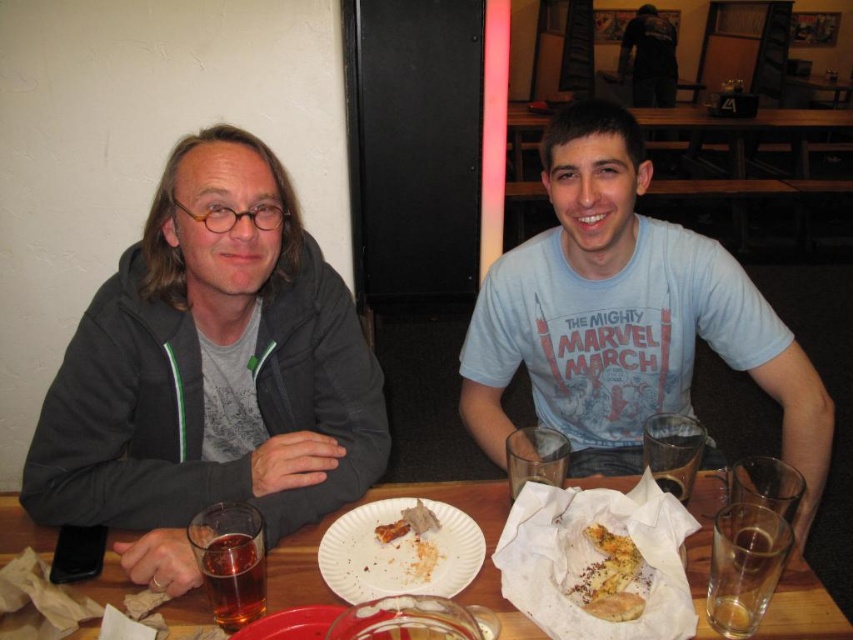
You are a photographer standing in front of the wooden table at center and the brown crumbly bread at center. You want to take a photo that focuses on the bread while keeping the table in the background. Which object should be placed closer to the camera?

The brown crumbly bread at center should be placed closer to the camera than the wooden table at center to focus on the bread while keeping the table in the background.

You are a waiter at the table. You need to place a new menu on the table. The menu is 12 inches wide. The translucent glass at table right and the brown crumbly bread at center are in the way. Which object should you move to make space for the menu?

The translucent glass at table right is positioned over brown crumbly bread at center. To make space for the menu, you should move the translucent glass at table right because it is covering the brown crumbly bread at center, so moving the glass would free up more space.